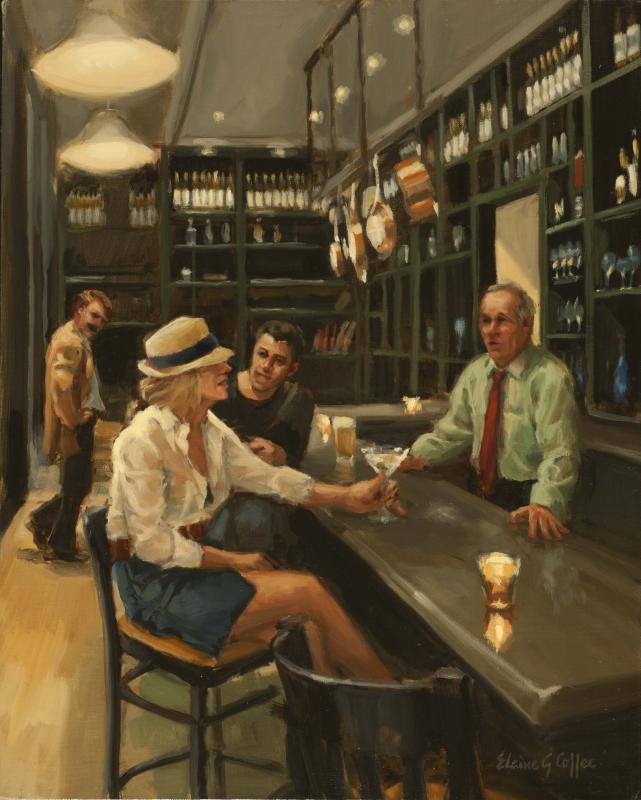
Find the location of a particular element. pots and pans is located at coordinates (410, 190), (379, 220), (354, 244), (331, 252).